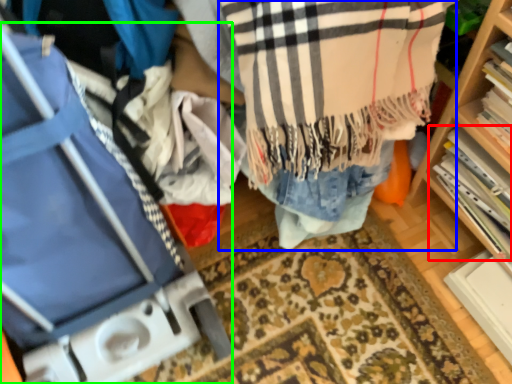
Question: Which object is positioned farthest from book (highlighted by a red box)? Select from clothing (highlighted by a blue box) and luggage (highlighted by a green box).

Choices:
 (A) clothing
 (B) luggage

Answer: (B)